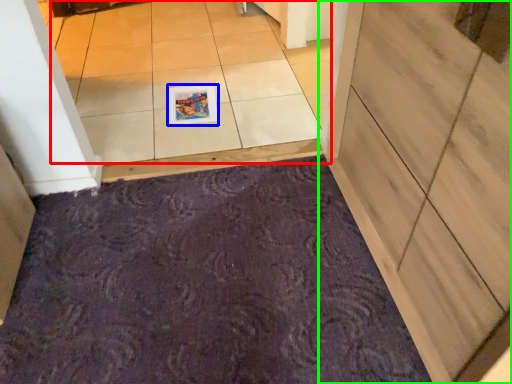
Question: Based on their relative distances, which object is farther from tile (highlighted by a red box)? Choose from postcard (highlighted by a blue box) and door (highlighted by a green box).

Choices:
 (A) postcard
 (B) door

Answer: (B)